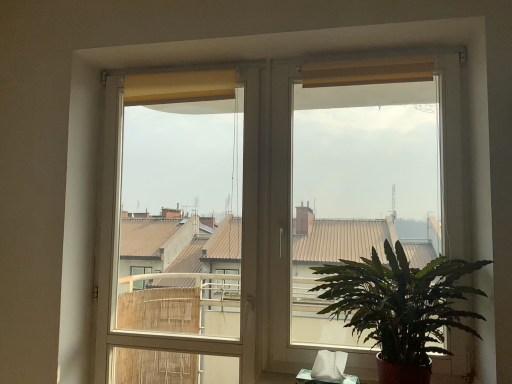
Question: From a real-world perspective, is matte yellow screen at right above or below white plastic window frame at center?

Choices:
 (A) below
 (B) above

Answer: (B)

Question: From the image's perspective, is matte yellow screen at right above or below white plastic window frame at center?

Choices:
 (A) above
 (B) below

Answer: (A)

Question: Which of these objects is positioned farthest from the green leafy plant at lower right?

Choices:
 (A) white plastic window frame at center
 (B) matte yellow screen at right

Answer: (A)

Question: Which is farther from the green leafy plant at lower right?

Choices:
 (A) matte yellow screen at right
 (B) white plastic window frame at center

Answer: (B)